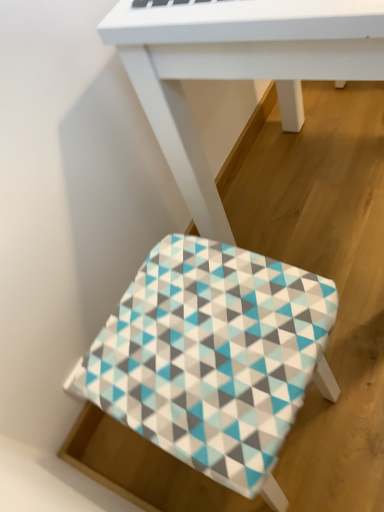
The image size is (384, 512). What do you see at coordinates (213, 358) in the screenshot?
I see `patterned fabric stool at lower center` at bounding box center [213, 358].

The height and width of the screenshot is (512, 384). I want to click on patterned fabric stool at lower center, so click(x=213, y=358).

Locate an element on the screen. The height and width of the screenshot is (512, 384). white matte table at center is located at coordinates (237, 68).

Describe the element at coordinates (237, 68) in the screenshot. Image resolution: width=384 pixels, height=512 pixels. I see `white matte table at center` at that location.

You are a GUI agent. You are given a task and a screenshot of the screen. Output one action in this format:
    pyautogui.click(x=<x>, y=<y>)
    Task: Click on the patterned fabric stool at lower center
    
    Given the screenshot: What is the action you would take?
    pyautogui.click(x=213, y=358)

Considering the relative positions of white matte table at center and patterned fabric stool at lower center in the image provided, is white matte table at center to the left or to the right of patterned fabric stool at lower center?

white matte table at center is positioned on patterned fabric stool at lower center's right side.

Relative to patterned fabric stool at lower center, is white matte table at center in front or behind?

In the image, white matte table at center appears in front of patterned fabric stool at lower center.

Is point (197, 217) positioned before point (264, 487)?

No, it is behind (264, 487).

From the image's perspective, between white matte table at center and patterned fabric stool at lower center, who is located below?

patterned fabric stool at lower center is shown below in the image.

From a real-world perspective, which object rests below the other?

In real-world perspective, patterned fabric stool at lower center is lower.

Considering the relative sizes of white matte table at center and patterned fabric stool at lower center in the image provided, is white matte table at center thinner than patterned fabric stool at lower center?

No, white matte table at center is not thinner than patterned fabric stool at lower center.

Between white matte table at center and patterned fabric stool at lower center, which one has more height?

Standing taller between the two is white matte table at center.

Is white matte table at center smaller than patterned fabric stool at lower center?

Incorrect, white matte table at center is not smaller in size than patterned fabric stool at lower center.

Would you say white matte table at center is outside patterned fabric stool at lower center?

Indeed, white matte table at center is completely outside patterned fabric stool at lower center.

Is white matte table at center far from patterned fabric stool at lower center?

They are positioned close to each other.

In the scene shown: Is white matte table at center oriented towards patterned fabric stool at lower center?

No, white matte table at center is not facing towards patterned fabric stool at lower center.

How many degrees apart are the facing directions of white matte table at center and patterned fabric stool at lower center?

The angle between the facing direction of white matte table at center and the facing direction of patterned fabric stool at lower center is 83.3 degrees.

How far apart are white matte table at center and patterned fabric stool at lower center?

white matte table at center and patterned fabric stool at lower center are 14.53 inches apart from each other.

What are the coordinates of `stool behind the white matte table at center` in the screenshot? It's located at (213, 358).

Which is more to the right, patterned fabric stool at lower center or white matte table at center?

white matte table at center.

Relative to white matte table at center, is patterned fabric stool at lower center in front or behind?

patterned fabric stool at lower center is positioned farther from the viewer than white matte table at center.

Which is nearer, (186, 354) or (302, 71)?

Point (186, 354)

From the image's perspective, which is above, patterned fabric stool at lower center or white matte table at center?

white matte table at center appears higher in the image.

Based on the photo, from a real-world perspective, is patterned fabric stool at lower center under white matte table at center?

Yes, from a real-world perspective, patterned fabric stool at lower center is beneath white matte table at center.

Considering the sizes of patterned fabric stool at lower center and white matte table at center in the image, is patterned fabric stool at lower center wider or thinner than white matte table at center?

Considering their sizes, patterned fabric stool at lower center looks slimmer than white matte table at center.

Consider the image. Can you confirm if patterned fabric stool at lower center is taller than white matte table at center?

No, patterned fabric stool at lower center is not taller than white matte table at center.

Based on the photo, does patterned fabric stool at lower center have a larger size compared to white matte table at center?

No, patterned fabric stool at lower center is not bigger than white matte table at center.

Is white matte table at center inside patterned fabric stool at lower center?

That's incorrect, white matte table at center is not inside patterned fabric stool at lower center.

Looking at this image, is patterned fabric stool at lower center far from white matte table at center?

That's not correct — patterned fabric stool at lower center is a little close to white matte table at center.

Does patterned fabric stool at lower center turn towards white matte table at center?

Yes, patterned fabric stool at lower center faces towards white matte table at center.

Where is `stool to the left of white matte table at center`? This screenshot has height=512, width=384. stool to the left of white matte table at center is located at coordinates (213, 358).

I want to click on table in front of the patterned fabric stool at lower center, so click(x=237, y=68).

The width and height of the screenshot is (384, 512). I want to click on table above the patterned fabric stool at lower center (from a real-world perspective), so click(237, 68).